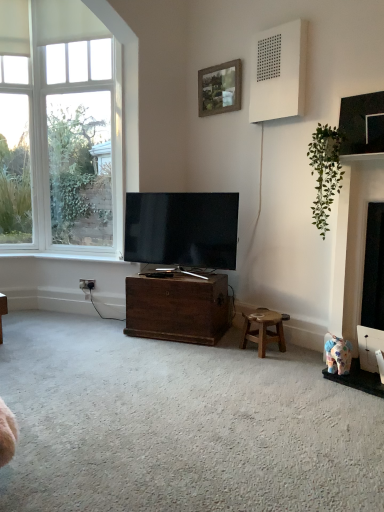
The image size is (384, 512). I want to click on blank space situated above wooden stool at lower right (from a real-world perspective), so click(x=261, y=314).